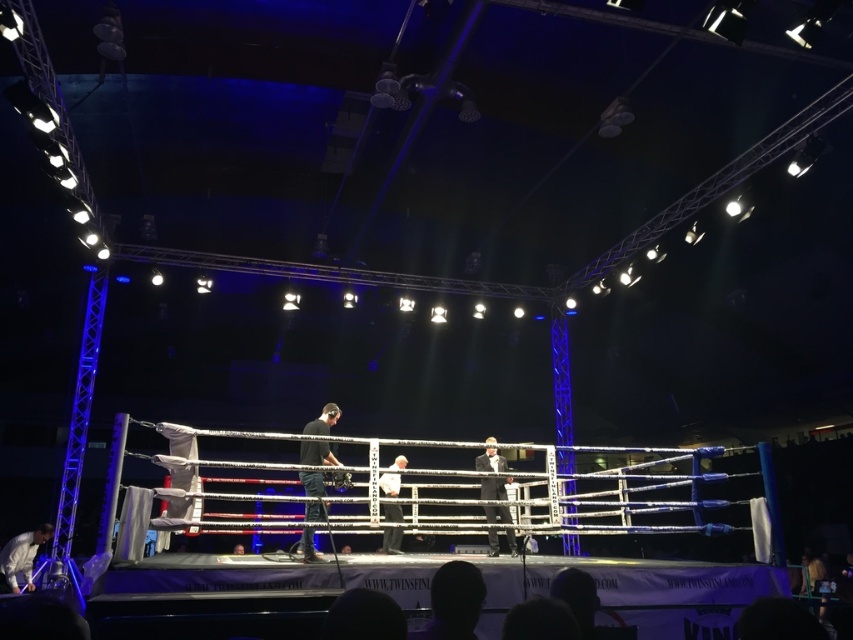
You are a photographer positioned outside the boxing ring. You need to take a photo of the shiny black suit at center without including the black matte camera at center in the frame. Is it possible to do so by moving to your right side?

The black matte camera at center is to the left of the shiny black suit at center. Moving to your right side would position you further away from the camera, potentially allowing you to frame the shot to exclude the camera while focusing on the suit.

You are a photographer positioned outside the boxing ring. You need to capture a photo that includes both the shiny black suit at center and the white fabric shirt at center. Which object should you frame first to ensure both are visible in the photo?

The shiny black suit at center is wider than the white fabric shirt at center, so you should frame the shiny black suit at center first to ensure the entire width of both objects fits in the photo.

You are a photographer positioned outside the boxing ring. You need to capture a clear photo of the shiny black suit at center without the black matte camera at center blocking the view. Is this possible based on their positions?

The black matte camera at center is in front of the shiny black suit at center, so it would block the view. Move to a different angle where the shiny black suit at center is visible without obstruction from the camera.